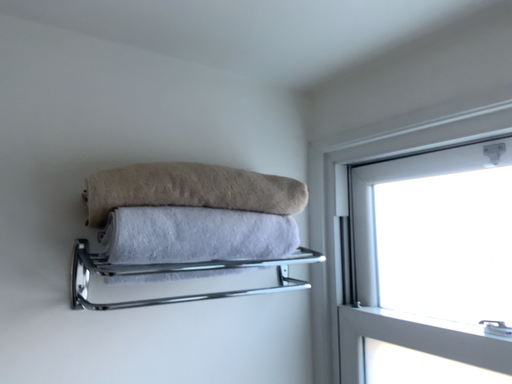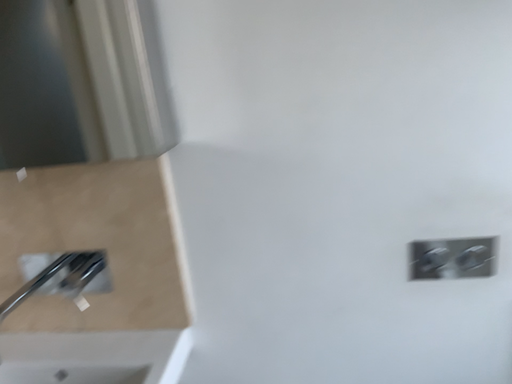
Question: Which way did the camera rotate in the video?

Choices:
 (A) rotated left
 (B) rotated right

Answer: (A)